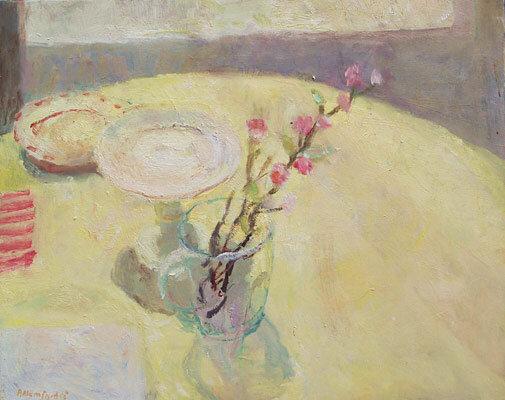
The width and height of the screenshot is (505, 400). Identify the location of plate. (81, 121).